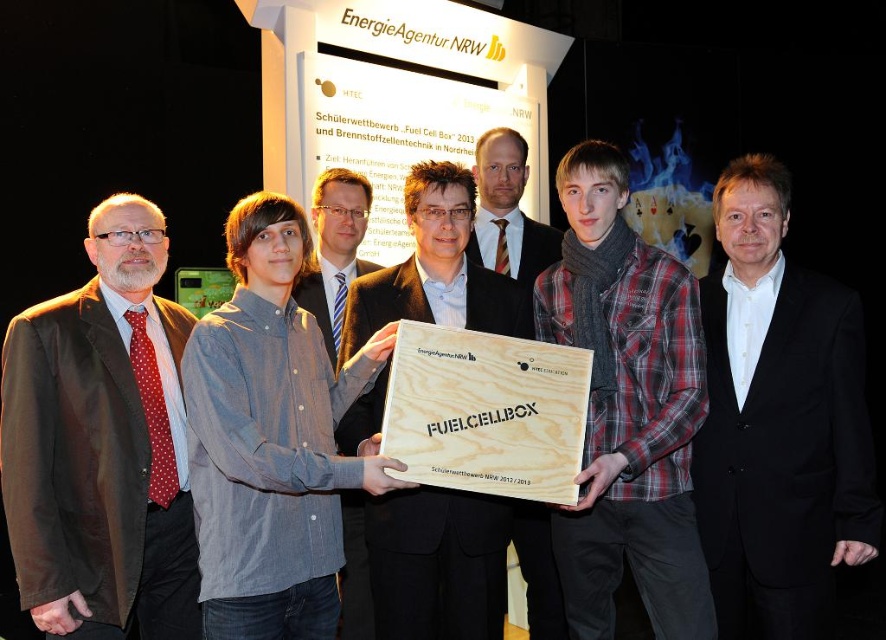
Question: Is brown fabric coat at left to the right of plaid shirt at center from the viewer's perspective?

Choices:
 (A) no
 (B) yes

Answer: (A)

Question: Based on their relative distances, which object is nearer to the wooden at center?

Choices:
 (A) denim shirt at center
 (B) black suit at center
 (C) matte black jacket at center
 (D) brown fabric coat at left

Answer: (B)

Question: Is black suit at center to the right of plaid shirt at center from the viewer's perspective?

Choices:
 (A) yes
 (B) no

Answer: (A)

Question: Where is plaid shirt at center located in relation to matte wood plaque at center in the image?

Choices:
 (A) left
 (B) right

Answer: (B)

Question: Which of the following is the farthest from the observer?

Choices:
 (A) (522, 260)
 (B) (612, 461)
 (C) (459, 307)
 (D) (525, 497)

Answer: (A)

Question: Which object appears farthest from the camera in this image?

Choices:
 (A) brown fabric coat at left
 (B) denim shirt at center
 (C) black suit at center

Answer: (B)